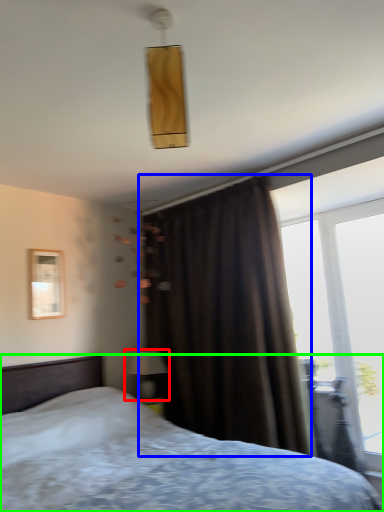
Question: Considering the real-world distances, which object is farthest from table lamp (highlighted by a red box)? curtain (highlighted by a blue box) or bed (highlighted by a green box)?

Choices:
 (A) curtain
 (B) bed

Answer: (B)